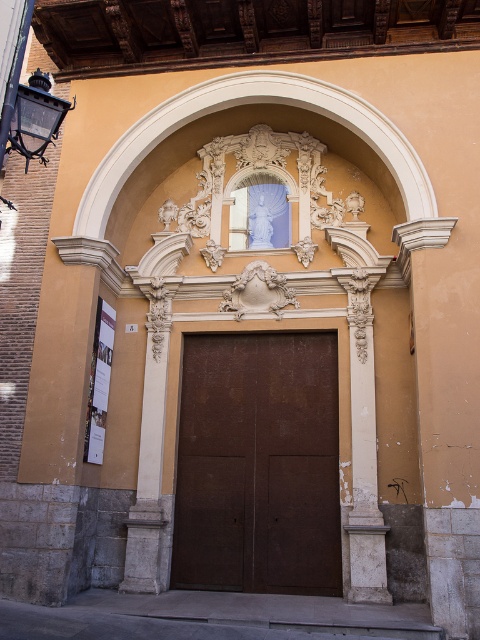
Which is more to the right, brown matte door at center or white stone column at left?

Positioned to the right is brown matte door at center.

Who is lower down, brown matte door at center or white stone column at left?

brown matte door at center is lower down.

Identify the location of brown matte door at center. This screenshot has width=480, height=640. (257, 465).

Find the location of a particular element. brown matte door at center is located at coordinates (257, 465).